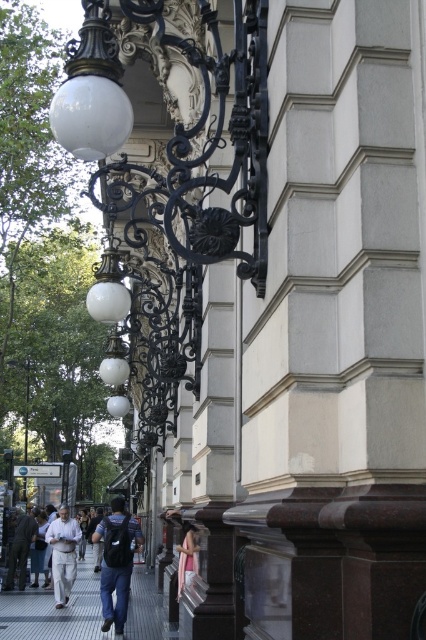
You are standing in front of the building and see both the gray concrete pavement at lower left and the dark gray fabric jacket at lower left. Which object is positioned to the right of the other?

The gray concrete pavement at lower left is to the right of the dark gray fabric jacket at lower left.

You are standing in front of the ornate building with the dark gray fabric jacket at lower left. Where exactly is the dark gray fabric jacket located on the building facade?

The dark gray fabric jacket at lower left is located at point (20, 547) on the building facade.

You are standing in front of the building and want to take a photo of the gray concrete pavement at lower left. Where should you position yourself to capture it in the frame?

To capture the gray concrete pavement at lower left in the frame, position yourself so that the pavement is located at the coordinates point (54, 611).